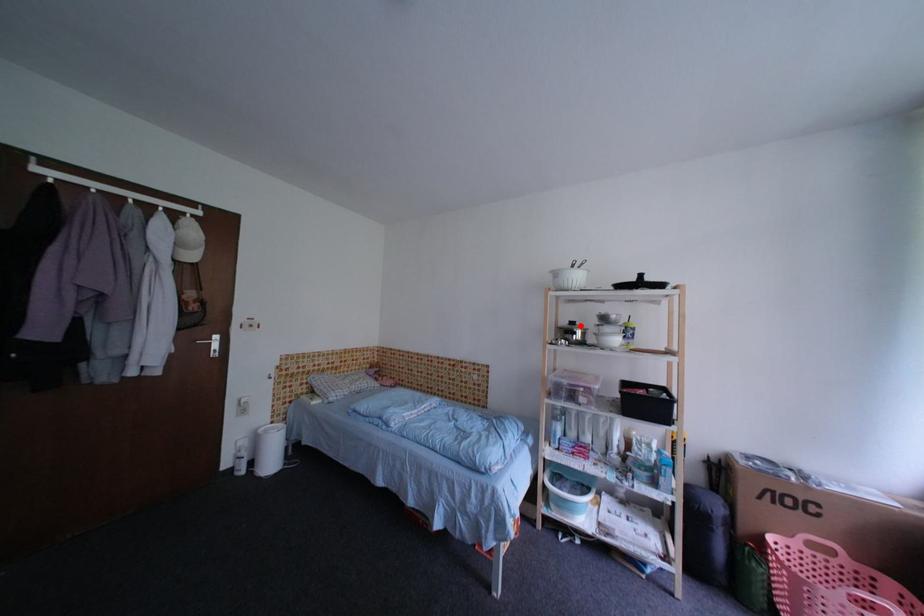
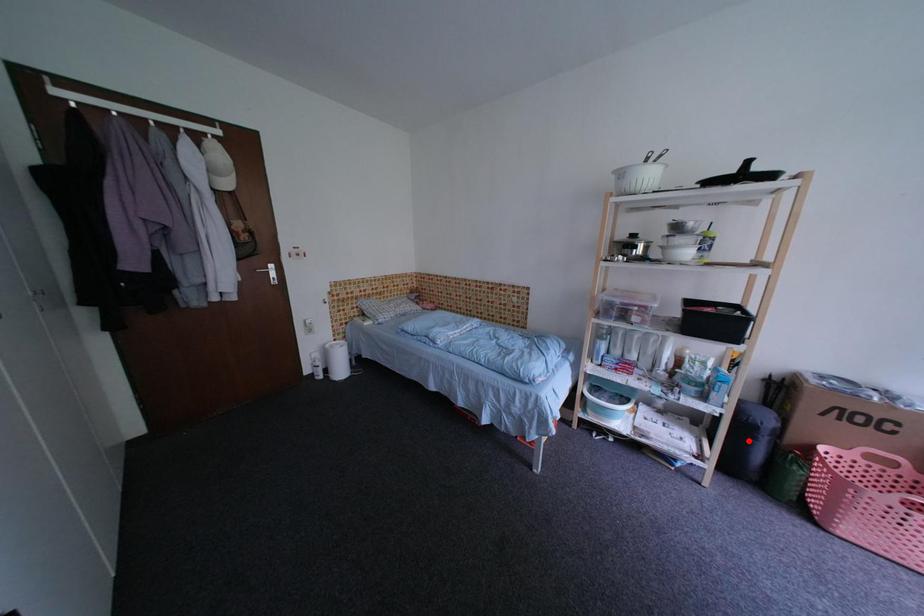
I am providing you with two images of the same scene from different viewpoints. A red point is marked on the first image and another point is marked on the second image. Is the marked point in image1 the same physical position as the marked point in image2?

No